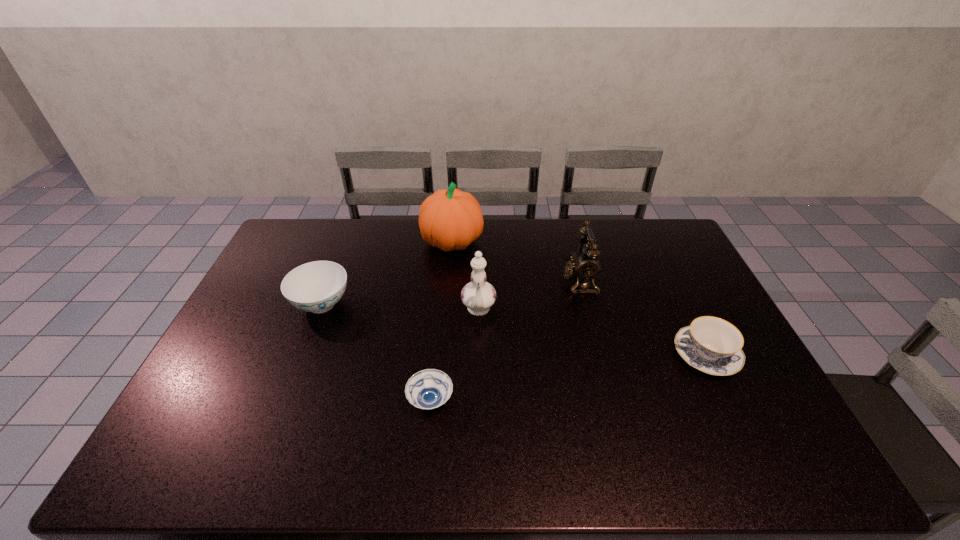
This screenshot has height=540, width=960. Identify the location of free space located 0.250m on the rotary dial of the second object from right to left. (489, 281).

Where is `vacant region located on the rotary dial of the second object from right to left`? The height and width of the screenshot is (540, 960). vacant region located on the rotary dial of the second object from right to left is located at coordinates (486, 281).

The image size is (960, 540). In order to click on vacant area situated on the front of the leftmost object in this screenshot , I will do `click(284, 400)`.

I want to click on free space located 0.350m with the handle on the side of the rightmost chinaware, so click(549, 355).

The image size is (960, 540). In order to click on free space located 0.140m with the handle on the side of the rightmost chinaware in this screenshot , I will do pyautogui.click(x=622, y=355).

The image size is (960, 540). In order to click on vacant space located with the handle on the side of the rightmost chinaware in this screenshot , I will do `click(640, 355)`.

This screenshot has height=540, width=960. In order to click on free region located 0.330m on the back of the shortest object in this screenshot , I will do `click(441, 298)`.

This screenshot has width=960, height=540. I want to click on object that is positioned at the far edge, so click(451, 219).

The image size is (960, 540). In order to click on object at the left edge in this screenshot , I will do `click(316, 287)`.

This screenshot has height=540, width=960. What are the coordinates of `object at the right edge` in the screenshot? It's located at (712, 345).